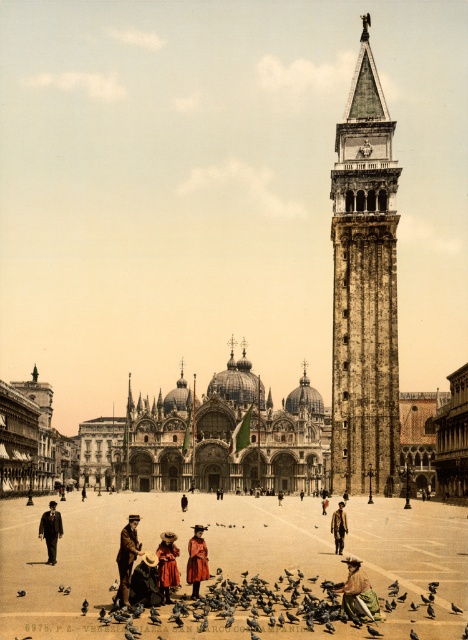
Question: Is brown leather jacket at center smaller than dark gray feathered bird at center?

Choices:
 (A) no
 (B) yes

Answer: (A)

Question: Which point is farther from the camera taking this photo?

Choices:
 (A) (459, 611)
 (B) (148, 589)
 (C) (339, 540)

Answer: (C)

Question: Which point appears closest to the camera in this image?

Choices:
 (A) (136, 600)
 (B) (51, 563)

Answer: (A)

Question: Observing the image, what is the correct spatial positioning of brown leather hat at lower right in reference to dark brown suit at lower left?

Choices:
 (A) right
 (B) left

Answer: (A)

Question: Can you confirm if brown leather hat at center is positioned to the right of red velvet coat at center?

Choices:
 (A) no
 (B) yes

Answer: (A)

Question: Which object is the farthest from the red velvet coat at center?

Choices:
 (A) brown leather coat at center
 (B) matte red dress at center
 (C) dark gray feathered bird at center
 (D) brown leather hat at lower right

Answer: (C)